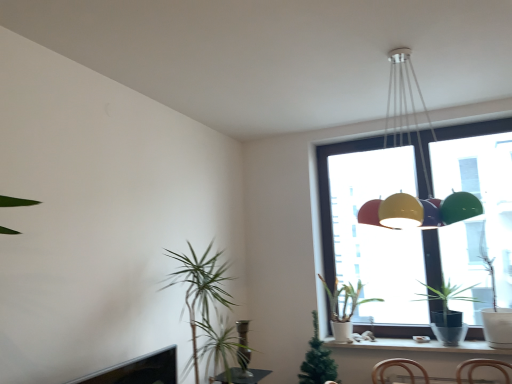
Question: Considering the relative positions of green glossy houseplant at window, which ranks as the 3th houseplant in left-to-right order, and white matte pot at window, the 2th houseplant from the left, in the image provided, is green glossy houseplant at window, which ranks as the 3th houseplant in left-to-right order, to the left or to the right of white matte pot at window, the 2th houseplant from the left,?

Choices:
 (A) right
 (B) left

Answer: (A)

Question: Considering the positions of point (449, 319) and point (343, 289), is point (449, 319) closer or farther from the camera than point (343, 289)?

Choices:
 (A) farther
 (B) closer

Answer: (B)

Question: Which is farther from the green leafy plant at left, marked as the first houseplant in a left-to-right arrangement?

Choices:
 (A) metallic pendant light at upper center
 (B) transparent glass window at upper right
 (C) white ceramic window sill at lower right
 (D) green glossy houseplant at window, the 1th houseplant viewed from the right
 (E) white matte pot at window, the 2th houseplant from the left

Answer: (A)

Question: Which is nearer to the metallic pendant light at upper center?

Choices:
 (A) white matte pot at window, which is the second houseplant in right-to-left order
 (B) green glossy houseplant at window, the 1th houseplant viewed from the right
 (C) transparent glass window at upper right
 (D) green leafy plant at left, arranged as the 3th houseplant when viewed from the right
 (E) white ceramic window sill at lower right

Answer: (C)